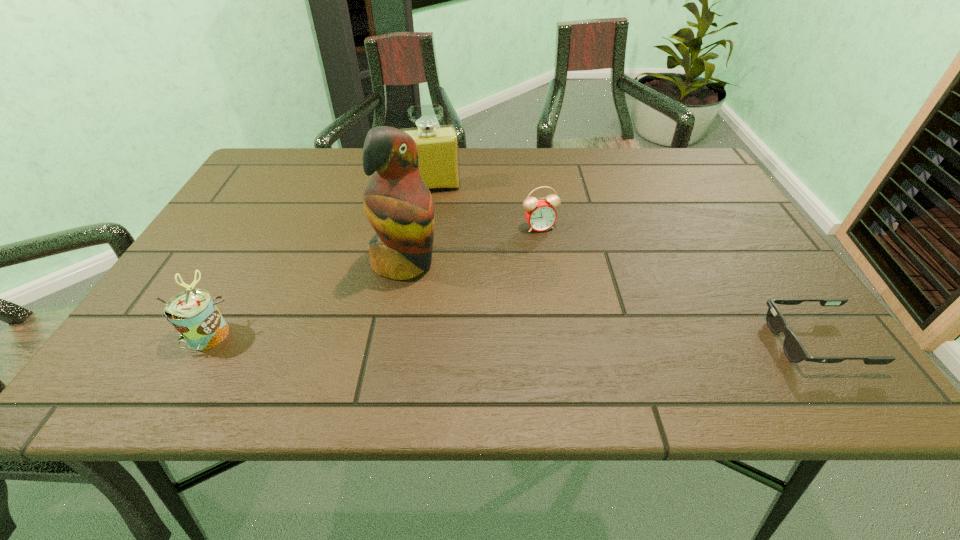
Where is `vacant region located 0.310m on the clock face of the fourth tallest object`? Image resolution: width=960 pixels, height=540 pixels. vacant region located 0.310m on the clock face of the fourth tallest object is located at coordinates (591, 332).

This screenshot has height=540, width=960. I want to click on vacant area located 0.340m on the clock face of the fourth tallest object, so click(598, 344).

Locate an element on the screen. This screenshot has height=540, width=960. vacant region located 0.300m on the clock face of the fourth tallest object is located at coordinates (589, 328).

Locate an element on the screen. object located in the far edge section of the desktop is located at coordinates (438, 146).

Where is `can at the near edge`? can at the near edge is located at coordinates (193, 313).

Locate an element on the screen. The height and width of the screenshot is (540, 960). sunglasses situated at the near edge is located at coordinates (794, 350).

What are the coordinates of `object that is at the left edge` in the screenshot? It's located at [x=193, y=313].

I want to click on object that is at the right edge, so click(x=794, y=350).

The image size is (960, 540). I want to click on object positioned at the near left corner, so click(193, 313).

You are a GUI agent. You are given a task and a screenshot of the screen. Output one action in this format:
    pyautogui.click(x=<x>, y=<y>)
    Task: Click on the object located in the near right corner section of the desktop
    This screenshot has width=960, height=540.
    Given the screenshot: What is the action you would take?
    pyautogui.click(x=794, y=350)